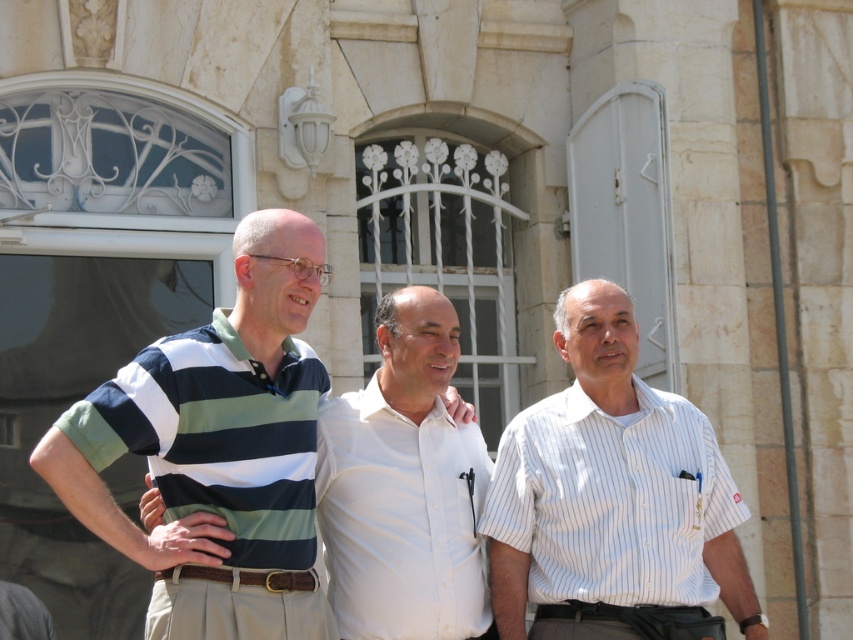
You are standing in front of the building and want to take a photo of the two points mentioned. Which point, point (659, 476) or point (236, 336), is closer to the camera?

Point (659, 476) is closer to the camera than point (236, 336).

Based on the coordinates provided, which object in the image is positioned at point [612,499]?

The white striped shirt at center is positioned at point [612,499].